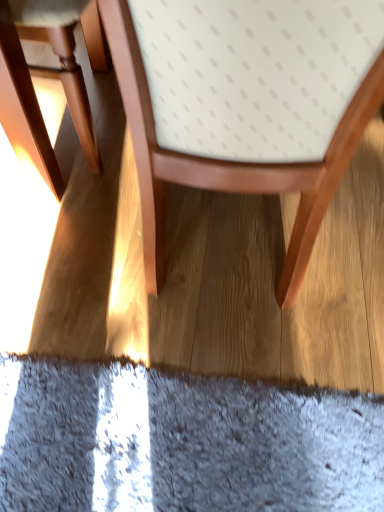
Locate an element on the screen. Image resolution: width=384 pixels, height=512 pixels. free region under wooden chair at center, the 1th chair when ordered from right to left (from a real-world perspective) is located at coordinates (226, 281).